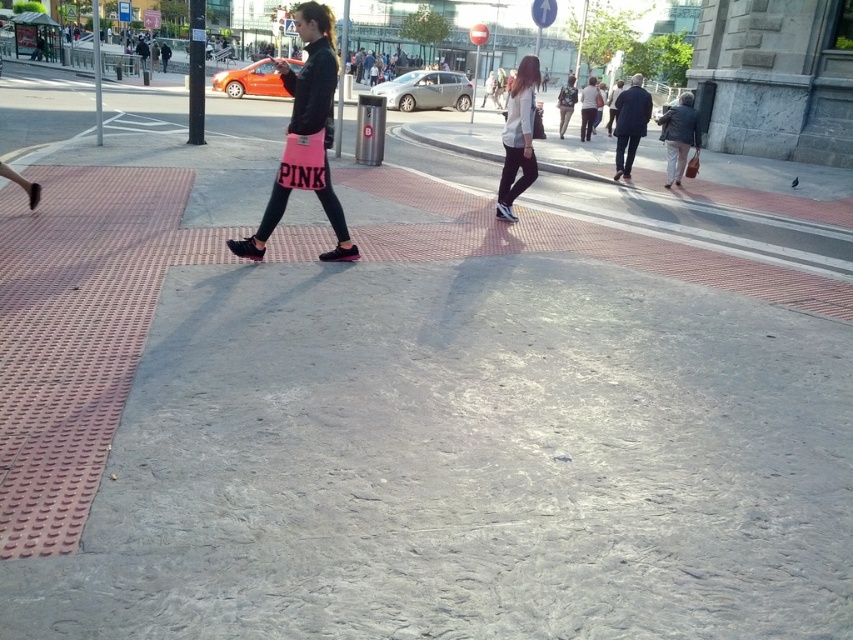
Does white matte shirt at center have a greater width compared to dark blue suit at center?

Yes, white matte shirt at center is wider than dark blue suit at center.

Who is lower down, white matte shirt at center or dark blue suit at center?

white matte shirt at center is below.

Does point (505, 161) come closer to viewer compared to point (625, 156)?

Yes, point (505, 161) is closer to viewer.

Identify the location of white matte shirt at center. This screenshot has width=853, height=640. (518, 138).

Consider the image. Is white matte shirt at center taller than brown leather jacket at right?

Yes.

Can you confirm if white matte shirt at center is positioned to the left of brown leather jacket at right?

Indeed, white matte shirt at center is positioned on the left side of brown leather jacket at right.

This screenshot has height=640, width=853. Find the location of `white matte shirt at center`. white matte shirt at center is located at coordinates (518, 138).

Does point (631, 104) come behind point (695, 148)?

Yes, it is behind point (695, 148).

Is dark blue suit at center smaller than brown leather jacket at right?

Yes, dark blue suit at center is smaller than brown leather jacket at right.

Locate an element on the screen. This screenshot has height=640, width=853. dark blue suit at center is located at coordinates (630, 124).